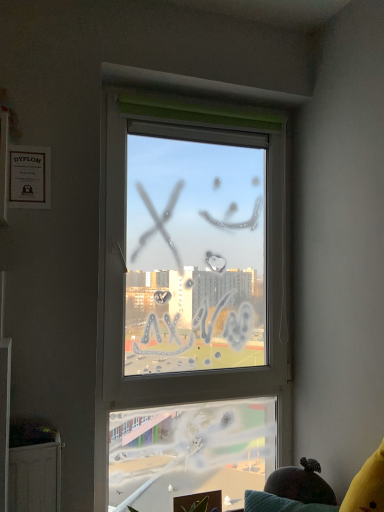
Question: Would you consider transparent glass window at center to be distant from velvet yellow couch at lower right?

Choices:
 (A) yes
 (B) no

Answer: (B)

Question: Is transparent glass window at center behind velvet yellow couch at lower right?

Choices:
 (A) yes
 (B) no

Answer: (A)

Question: Is transparent glass window at center not within velvet yellow couch at lower right?

Choices:
 (A) no
 (B) yes

Answer: (B)

Question: Is transparent glass window at center positioned in front of velvet yellow couch at lower right?

Choices:
 (A) no
 (B) yes

Answer: (A)

Question: Is transparent glass window at center smaller than velvet yellow couch at lower right?

Choices:
 (A) no
 (B) yes

Answer: (A)

Question: Is transparent glass window at center to the right of velvet yellow couch at lower right from the viewer's perspective?

Choices:
 (A) yes
 (B) no

Answer: (B)

Question: Does velvet yellow couch at lower right contain transparent glass window at center?

Choices:
 (A) no
 (B) yes

Answer: (A)

Question: From a real-world perspective, is velvet yellow couch at lower right located higher than transparent glass window at center?

Choices:
 (A) yes
 (B) no

Answer: (B)

Question: From the image's perspective, would you say velvet yellow couch at lower right is shown under transparent glass window at center?

Choices:
 (A) yes
 (B) no

Answer: (A)

Question: From a real-world perspective, is velvet yellow couch at lower right beneath transparent glass window at center?

Choices:
 (A) yes
 (B) no

Answer: (A)

Question: Is velvet yellow couch at lower right further to the viewer compared to transparent glass window at center?

Choices:
 (A) yes
 (B) no

Answer: (B)

Question: Is velvet yellow couch at lower right completely or partially outside of transparent glass window at center?

Choices:
 (A) yes
 (B) no

Answer: (A)

Question: From the image's perspective, is velvet yellow couch at lower right located above or below transparent glass window at center?

Choices:
 (A) above
 (B) below

Answer: (B)